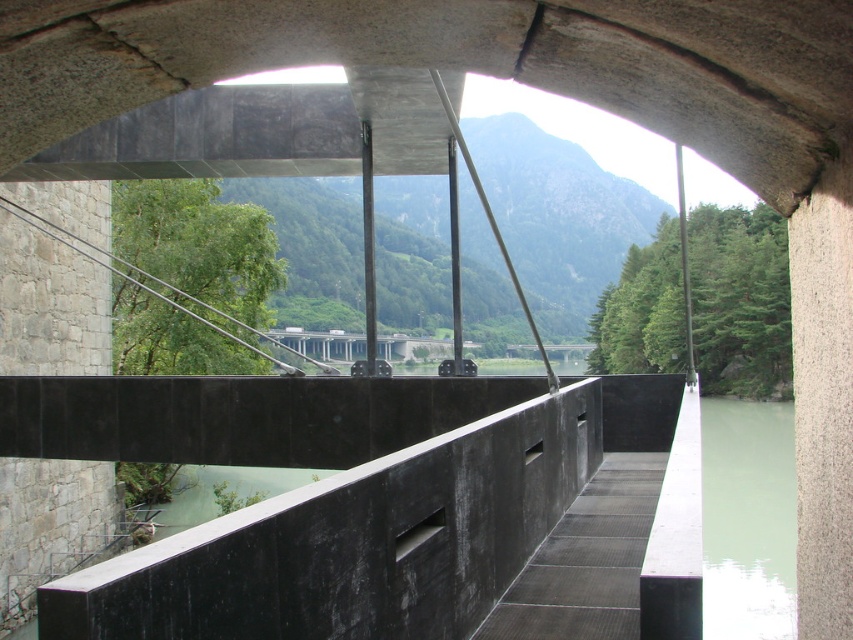
You are standing inside the concrete structure and looking out through the opening. You see the greenish concrete river at right and the green concrete river at lower center. Which river is nearer to you?

The greenish concrete river at right is closer to the viewer than the green concrete river at lower center, so the greenish concrete river at right is nearer to you.

Based on the photo, you are standing inside the concrete structure and looking out through the opening. You see two rivers, the greenish concrete river at right and the green concrete river at lower center. Which river is located more to the right side?

The greenish concrete river at right is positioned on the right side of the green concrete river at lower center, so it is more to the right side.

You are standing inside the concrete structure and want to reach the point marked at coordinates point (753, 577). If you have a 30 meter long rope, can you safely reach that point using the rope?

The distance between you and point (753, 577) is 27.66 meters. Since the rope is 30 meters long, which is longer than the required distance, you can safely reach the point using the rope.